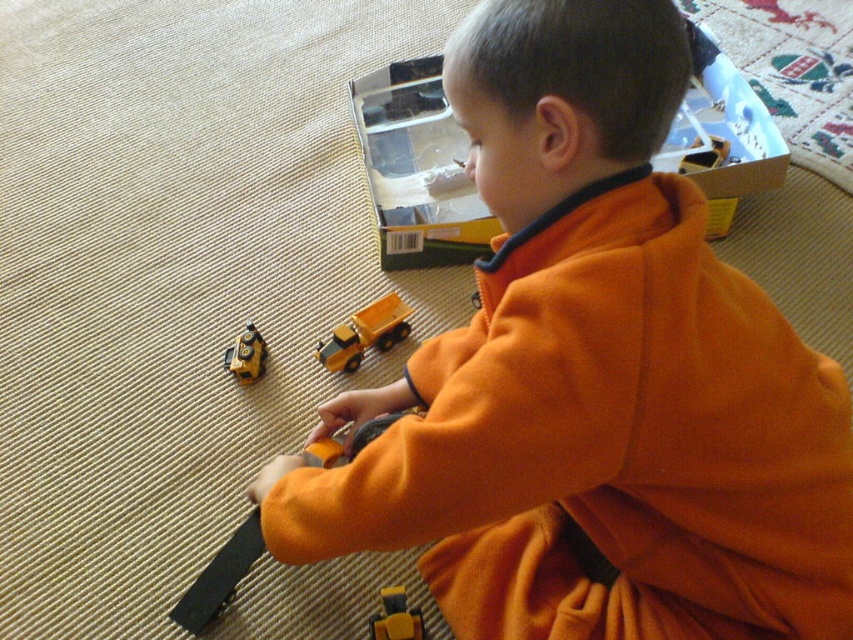
Question: Where is yellow matte toy truck at lower center located in relation to metallic yellow truck at lower left in the image?

Choices:
 (A) above
 (B) below

Answer: (B)

Question: Which object is the closest to the orange fleece jacket at center?

Choices:
 (A) yellow matte toy truck at lower center
 (B) yellow matte dump truck at center
 (C) metallic yellow truck at lower left

Answer: (A)

Question: Can you confirm if orange fleece jacket at center is positioned above metallic yellow truck at lower left?

Choices:
 (A) yes
 (B) no

Answer: (B)

Question: Can you confirm if orange fleece jacket at center is bigger than yellow matte toy truck at lower center?

Choices:
 (A) yes
 (B) no

Answer: (A)

Question: Which object is farther from the camera taking this photo?

Choices:
 (A) yellow matte toy truck at lower center
 (B) orange fleece jacket at center
 (C) yellow matte dump truck at center

Answer: (C)

Question: Which object appears farthest from the camera in this image?

Choices:
 (A) yellow matte toy truck at lower center
 (B) yellow matte dump truck at center
 (C) metallic yellow truck at lower left
 (D) orange fleece jacket at center

Answer: (B)